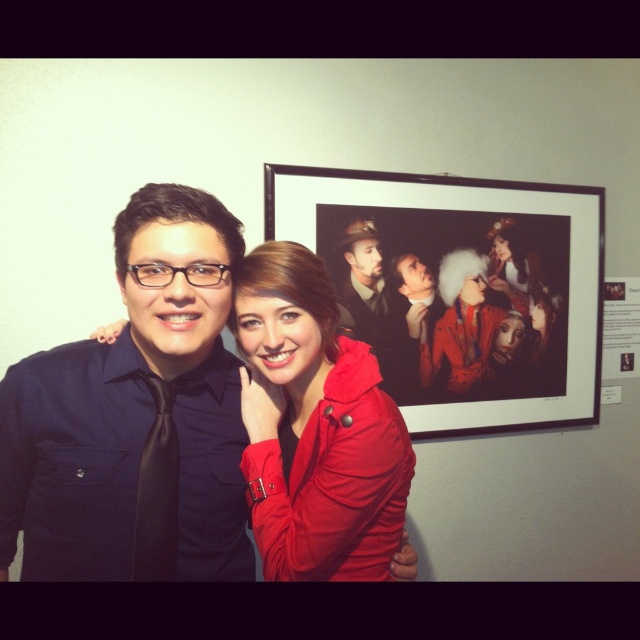
You are a photographer setting up a shot. You need to ensure that the matte black shirt at left and the white paper at upper right are both visible in the frame. Given their height difference, which object might require you to adjust your camera angle to include it properly?

The matte black shirt at left is much taller than the white paper at upper right, so you might need to adjust the camera angle to ensure the taller matte black shirt at left is fully captured in the frame.

You are a photographer trying to focus on the matte black shirt at left and the white paper at upper right. Which object is positioned further to the left in the image?

The matte black shirt at left is positioned further to the left than the white paper at upper right.

You are a photographer trying to adjust the lighting for a portrait. You notice the matte red coat at center and the matte black suit at center. Which object should you focus on first if you want to ensure the foreground subject is properly lit?

The matte red coat at center is in front of the matte black suit at center, so you should focus on the matte red coat at center first to ensure the foreground subject is properly lit.